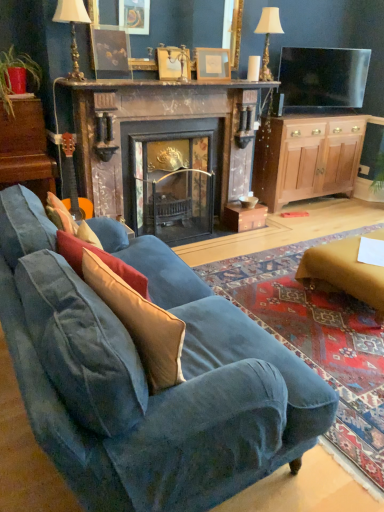
Question: From their relative heights in the image, would you say wooden dresser at left is taller or shorter than white fabric lampshade at upper center, placed as the first lamp when sorted from right to left?

Choices:
 (A) tall
 (B) short

Answer: (A)

Question: From a real-world perspective, is wooden dresser at left physically located above or below white fabric lampshade at upper center, the first lamp from the back?

Choices:
 (A) above
 (B) below

Answer: (B)

Question: Which of these objects is positioned closest to the gold metallic lamp at upper left, the first lamp positioned from the front?

Choices:
 (A) velvet blue couch at lower left
 (B) dark wood mantel at upper center
 (C) velvet beige throw pillow at lower left
 (D) matte black picture frame at upper center, which is the third picture frame in right-to-left order
 (E) wooden dresser at left

Answer: (D)

Question: Which object is positioned farthest from the white fabric lampshade at upper center, arranged as the second lamp when viewed from the front?

Choices:
 (A) brown suede pillow at center
 (B) velvet blue couch at lower left
 (C) gold metallic lamp at upper left, positioned as the 2th lamp in right-to-left order
 (D) velvet beige throw pillow at lower left
 (E) wooden dresser at left

Answer: (D)